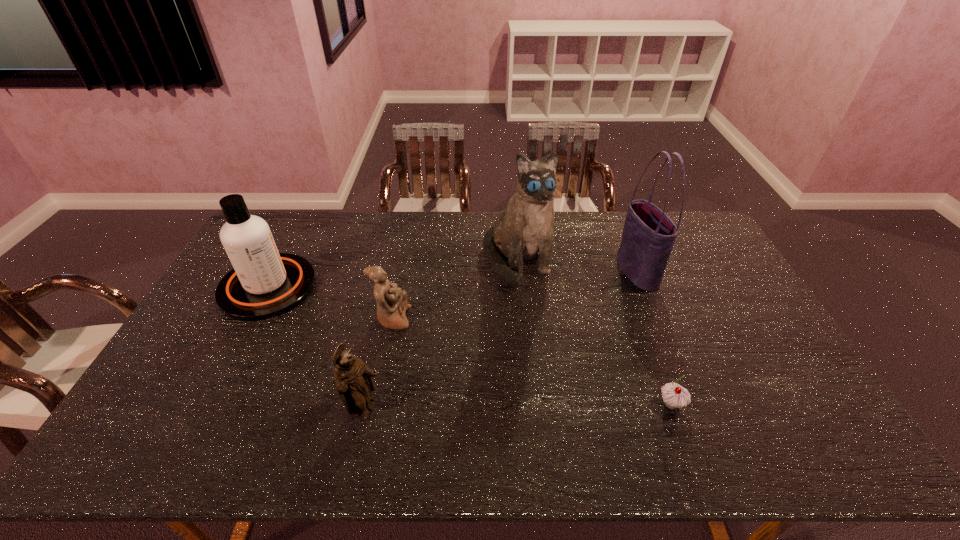
Identify the location of free spot between the tote bag and the cleansing agent. Image resolution: width=960 pixels, height=540 pixels. (452, 279).

The image size is (960, 540). In order to click on free spot between the cupcake and the tote bag in this screenshot , I will do 654,338.

I want to click on vacant space that is in between the nearer figurine and the shortest object, so click(518, 407).

Locate an element on the screen. vacant space that's between the cat and the cupcake is located at coordinates (594, 332).

Locate an element on the screen. free space that is in between the shortest object and the tote bag is located at coordinates [654, 338].

Locate an element on the screen. This screenshot has width=960, height=540. vacant region between the cupcake and the nearer figurine is located at coordinates (518, 407).

Find the location of a particular element. Image resolution: width=960 pixels, height=540 pixels. empty space between the nearer figurine and the cat is located at coordinates (442, 334).

I want to click on empty space that is in between the tote bag and the leftmost object, so (452, 279).

Identify the location of the third closest object relative to the cat. (675, 396).

The height and width of the screenshot is (540, 960). I want to click on object that is the third closest to the nearer figurine, so click(523, 232).